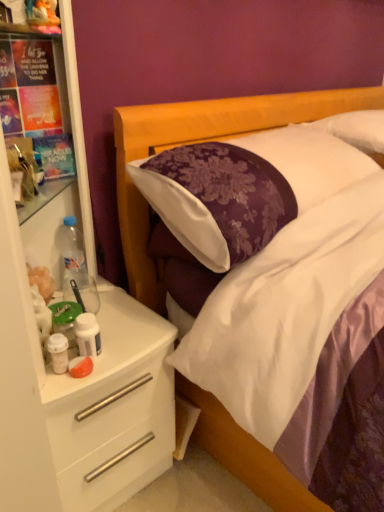
The width and height of the screenshot is (384, 512). Identify the location of vacant area that lies to the right of white glossy bottle at left, positioned as the first bottle in right-to-left order. (132, 350).